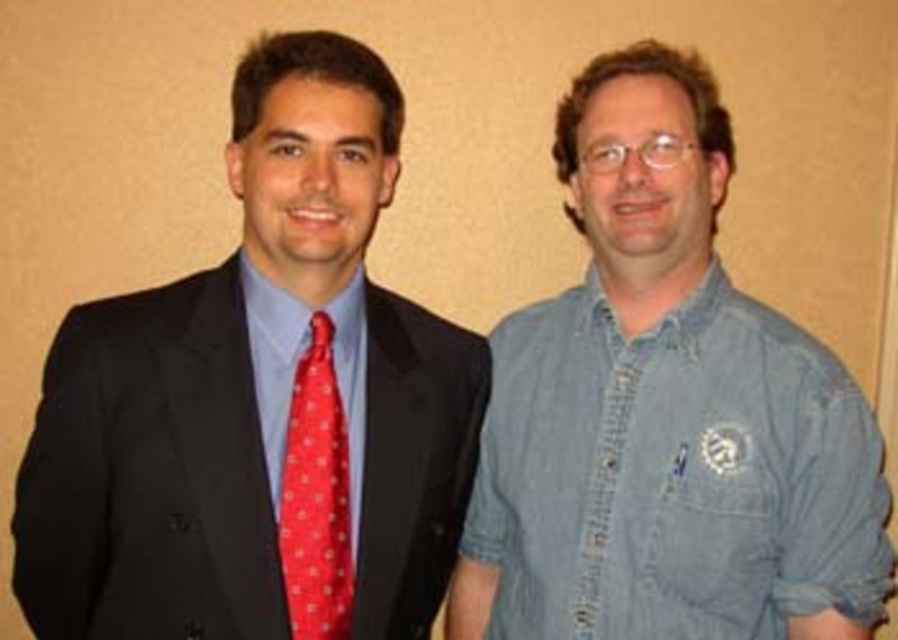
Can you confirm if matte black suit at left is smaller than denim shirt at right?

Yes, matte black suit at left is smaller than denim shirt at right.

Does point (236, 573) lie in front of point (741, 573)?

Yes, point (236, 573) is closer to viewer.

Is point (221, 316) behind point (547, 346)?

That is False.

Locate an element on the screen. This screenshot has height=640, width=898. matte black suit at left is located at coordinates (260, 403).

How far apart are matte black suit at left and red dotted fabric tie at left?

A distance of 5.19 inches exists between matte black suit at left and red dotted fabric tie at left.

Does point (381, 625) lie behind point (345, 452)?

Yes, it is.

I want to click on matte black suit at left, so click(x=260, y=403).

Can you confirm if denim shirt at right is shorter than red dotted fabric tie at left?

Incorrect, denim shirt at right's height does not fall short of red dotted fabric tie at left's.

Is denim shirt at right further to camera compared to red dotted fabric tie at left?

Yes, it is.

Does point (694, 541) come farther from viewer compared to point (280, 484)?

Yes, point (694, 541) is farther from viewer.

You are a GUI agent. You are given a task and a screenshot of the screen. Output one action in this format:
    pyautogui.click(x=<x>, y=<y>)
    Task: Click on the denim shirt at right
    
    Given the screenshot: What is the action you would take?
    pyautogui.click(x=665, y=412)